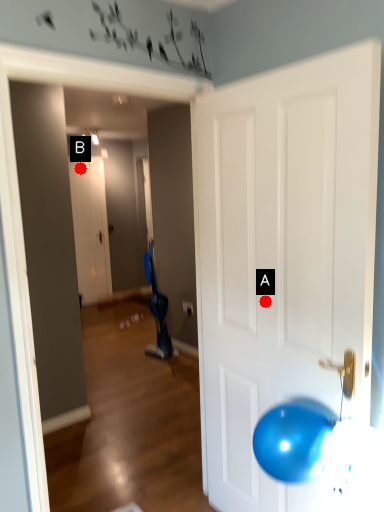
Question: Two points are circled on the image, labeled by A and B beside each circle. Which of the following is the closest to the observer?

Choices:
 (A) A is closer
 (B) B is closer

Answer: (A)